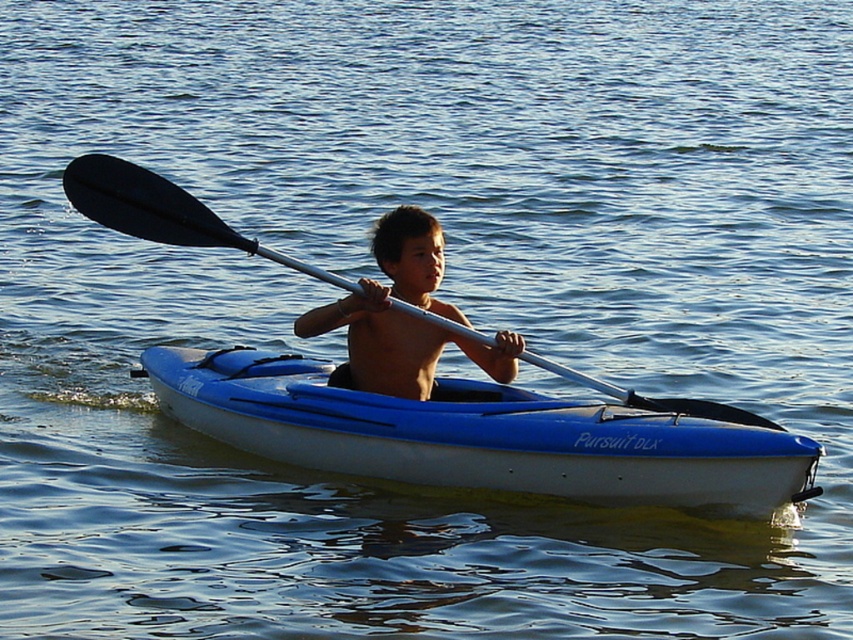
Question: Which point is farther to the camera?

Choices:
 (A) black rubber paddle at center
 (B) blue plastic canoe at center
 (C) smooth skin boy at center

Answer: (A)

Question: Does blue plastic canoe at center appear on the left side of black rubber paddle at center?

Choices:
 (A) no
 (B) yes

Answer: (A)

Question: Can you confirm if blue plastic canoe at center is positioned below black rubber paddle at center?

Choices:
 (A) no
 (B) yes

Answer: (B)

Question: Which point appears farthest from the camera in this image?

Choices:
 (A) (323, 468)
 (B) (149, 172)

Answer: (A)

Question: From the image, what is the correct spatial relationship of smooth skin boy at center in relation to black rubber paddle at center?

Choices:
 (A) above
 (B) below

Answer: (B)

Question: Which of the following is the closest to the observer?

Choices:
 (A) blue plastic canoe at center
 (B) smooth skin boy at center
 (C) black rubber paddle at center

Answer: (A)